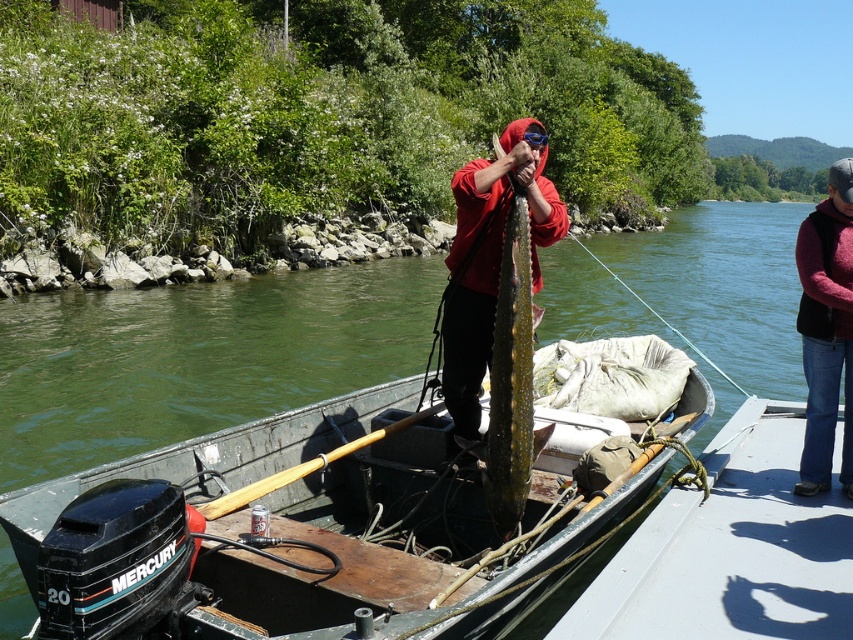
You are navigating a small motorboat with a Mercury outboard motor at the stern. You need to place a heavy object at the point where the maroon sweater at right is located. Is this point on the boat or in the water?

The maroon sweater at right is located at point (827, 330). Since the coordinates are within the boat, placing the heavy object there would be on the boat.